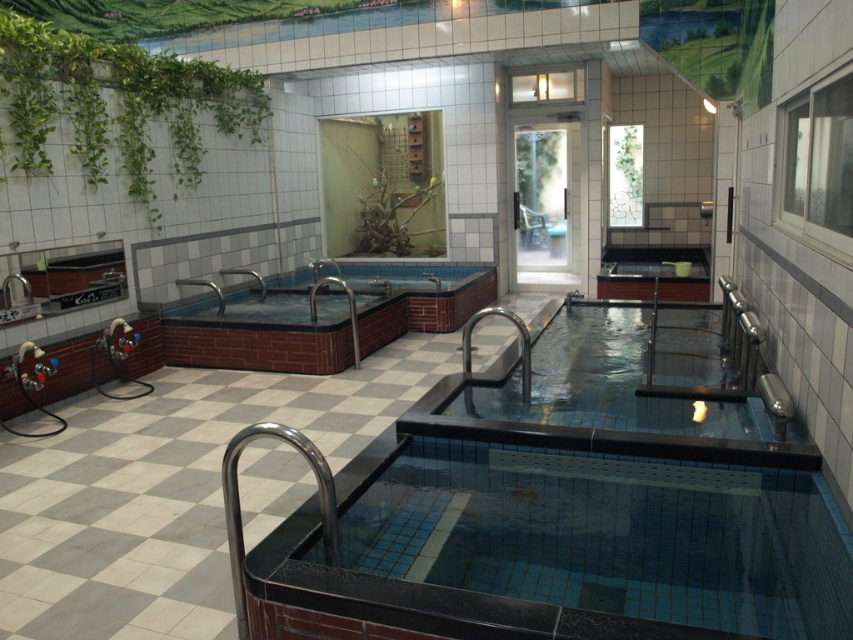
Looking at this image, can you confirm if blue ceramic jacuzzi at center is thinner than green leafy plant at upper center?

In fact, blue ceramic jacuzzi at center might be wider than green leafy plant at upper center.

Is blue ceramic jacuzzi at center wider than green leafy plant at upper center?

Yes.

Who is more forward, (424,268) or (729,8)?

Point (729,8) is in front.

The height and width of the screenshot is (640, 853). In order to click on blue ceramic jacuzzi at center in this screenshot , I will do `click(263, 333)`.

Can you confirm if green leafy plant at upper left is positioned to the right of blue ceramic jacuzzi at center?

No, green leafy plant at upper left is not to the right of blue ceramic jacuzzi at center.

Which is behind, point (117, 118) or point (299, 330)?

Point (117, 118)

Is point (123, 99) farther from camera compared to point (267, 292)?

No.

Locate an element on the screen. This screenshot has width=853, height=640. green leafy plant at upper left is located at coordinates click(119, 106).

Does blue mosaic tile swimming pool at center appear on the left side of green leafy plant at upper left?

No, blue mosaic tile swimming pool at center is not to the left of green leafy plant at upper left.

Does point (816, 600) lie behind point (202, 76)?

No.

Locate an element on the screen. blue mosaic tile swimming pool at center is located at coordinates (566, 513).